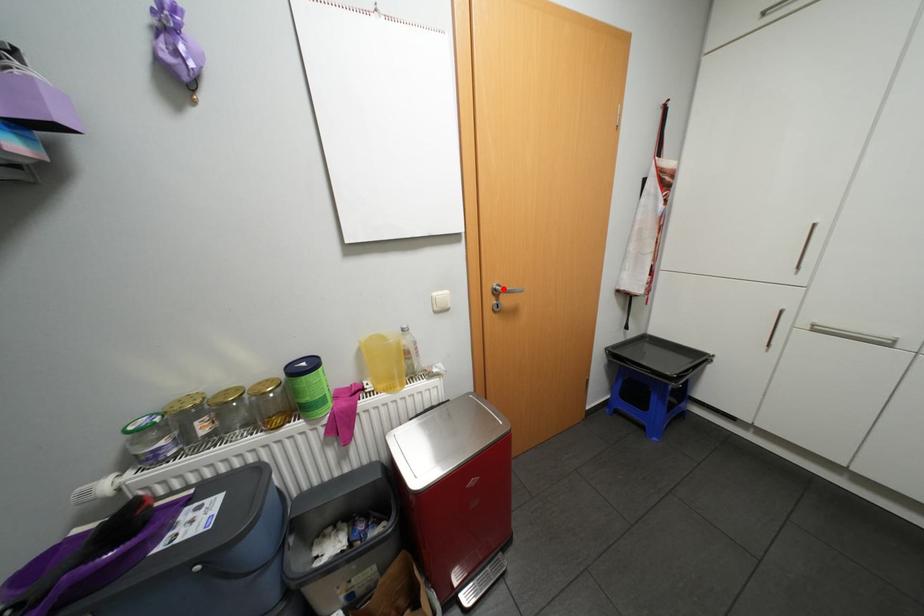
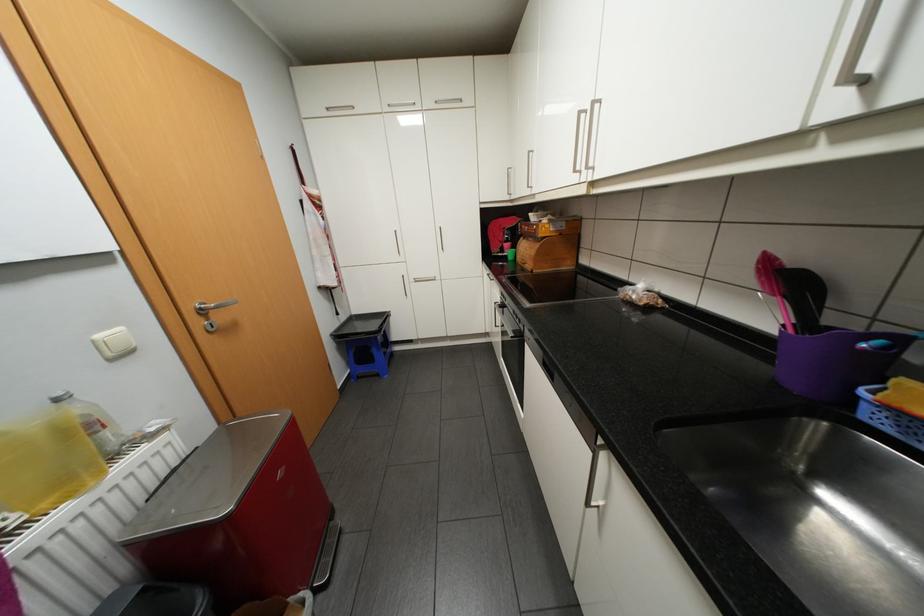
In the second image, find the point that corresponds to the highlighted location in the first image.

(209, 308)